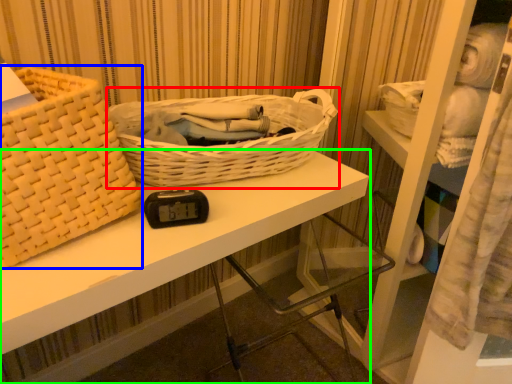
Question: Which is farther away from picnic basket (highlighted by a red box)? picnic basket (highlighted by a blue box) or desk (highlighted by a green box)?

Choices:
 (A) picnic basket
 (B) desk

Answer: (A)